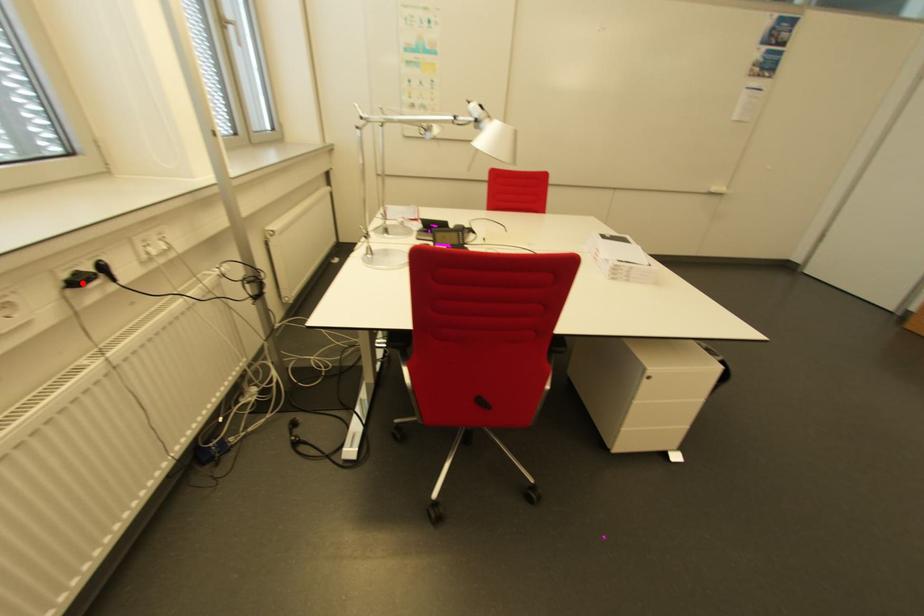
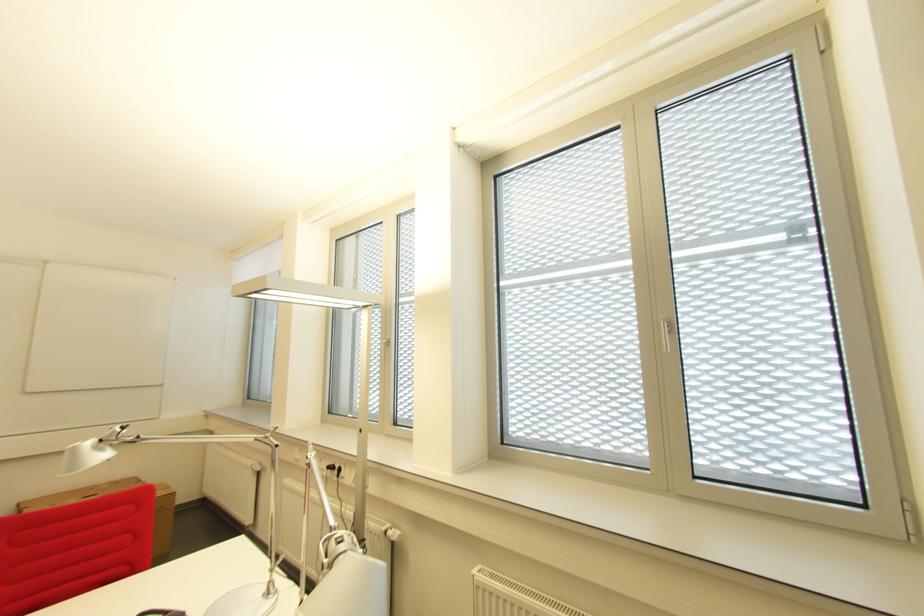
Question: A red point is marked in image1. In image2, is the corresponding 3D point closer to the camera or farther? Reply with the corresponding letter.

Choices:
 (A) The corresponding 3D point is closer.
 (B) The corresponding 3D point is farther.

Answer: (B)